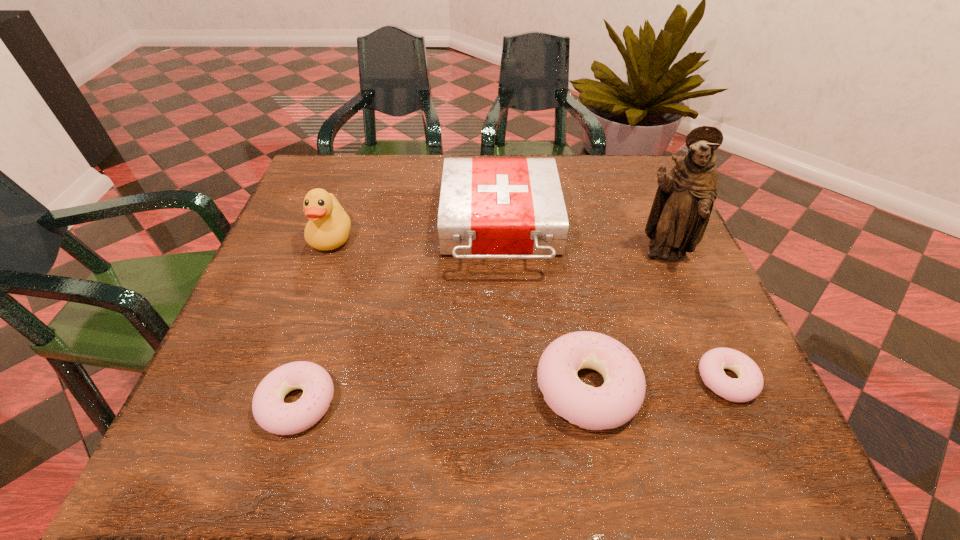
Where is `vacant point located between the tallest doughnut and the figurine`? The image size is (960, 540). vacant point located between the tallest doughnut and the figurine is located at coordinates (626, 321).

Where is `empty space between the leftmost doughnut and the tallest object`? The image size is (960, 540). empty space between the leftmost doughnut and the tallest object is located at coordinates (480, 329).

You are a GUI agent. You are given a task and a screenshot of the screen. Output one action in this format:
    pyautogui.click(x=<x>, y=<y>)
    Task: Click on the free spot between the first-aid kit and the third shortest object
    
    Given the screenshot: What is the action you would take?
    pyautogui.click(x=544, y=307)

Find the location of a particular element. The height and width of the screenshot is (540, 960). free point between the shortest doughnut and the duck is located at coordinates point(529,308).

Locate an element on the screen. free space between the second shortest object and the shortest doughnut is located at coordinates 512,391.

Locate an element on the screen. This screenshot has height=540, width=960. free space between the second tallest object and the first-aid kit is located at coordinates (416, 233).

Point out which object is positioned as the fourth nearest to the fifth shortest object. Please provide its 2D coordinates. Your answer should be formatted as a tuple, i.e. [(x, y)], where the tuple contains the x and y coordinates of a point satisfying the conditions above.

[(680, 213)]

Locate which object ranks fifth in proximity to the fifth shortest object. Please provide its 2D coordinates. Your answer should be formatted as a tuple, i.e. [(x, y)], where the tuple contains the x and y coordinates of a point satisfying the conditions above.

[(748, 386)]

Where is `doughnut object that ranks as the closest to the rightmost doughnut`? doughnut object that ranks as the closest to the rightmost doughnut is located at coordinates (618, 400).

Where is `doughnut that is the second closest one to the second shortest object`? doughnut that is the second closest one to the second shortest object is located at coordinates (748, 386).